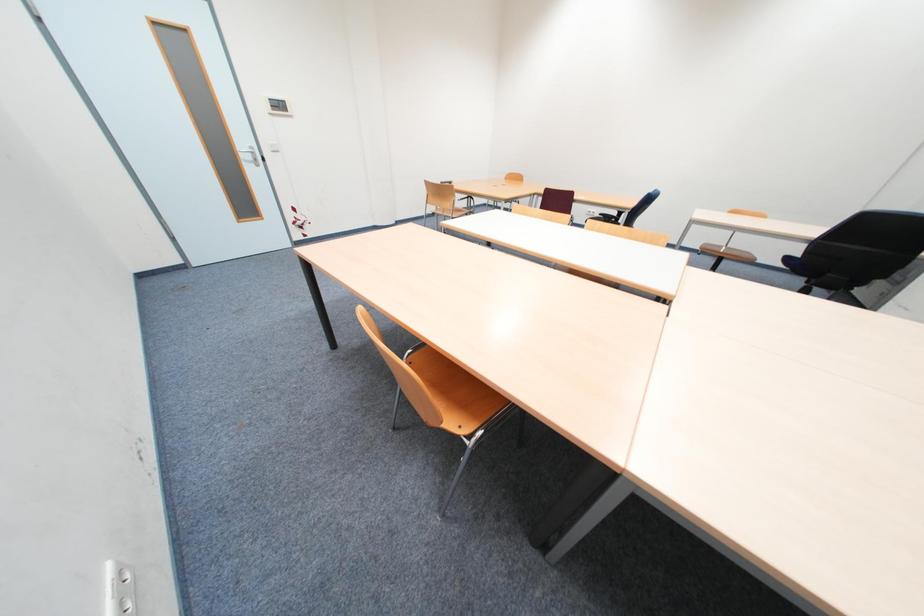
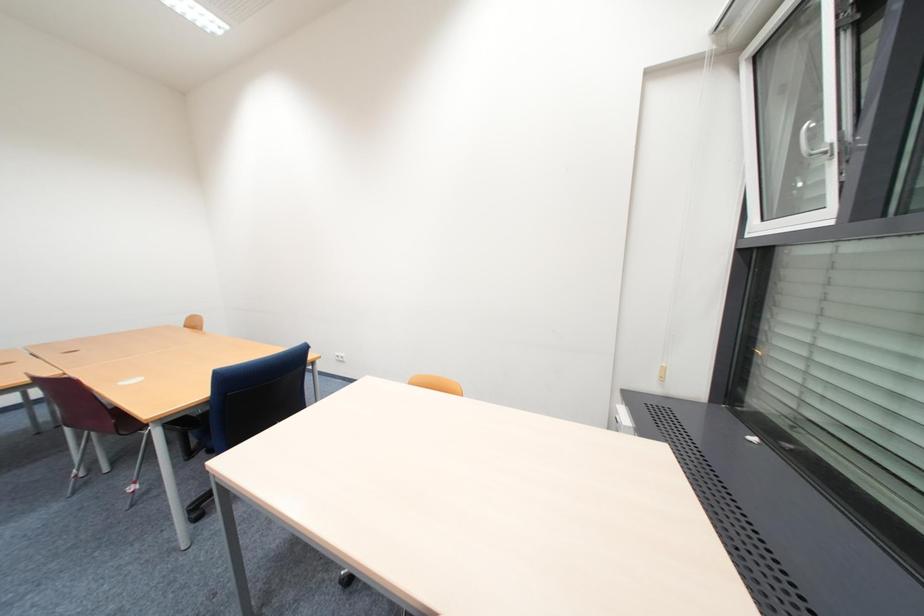
Consider the image. The images are taken continuously from a first-person perspective. In which direction are you moving?

The cameraman moved toward right, forward.